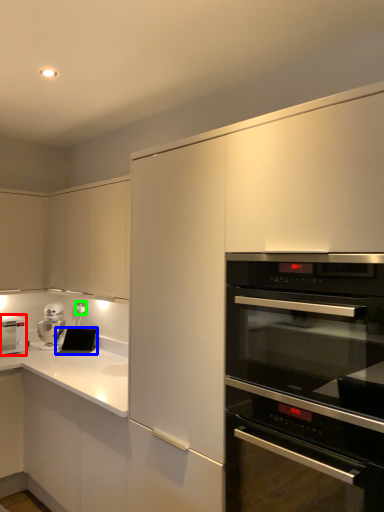
Question: Which is nearer to the home appliance (highlighted by a red box)? appliance (highlighted by a blue box) or electric outlet (highlighted by a green box).

Choices:
 (A) appliance
 (B) electric outlet

Answer: (A)